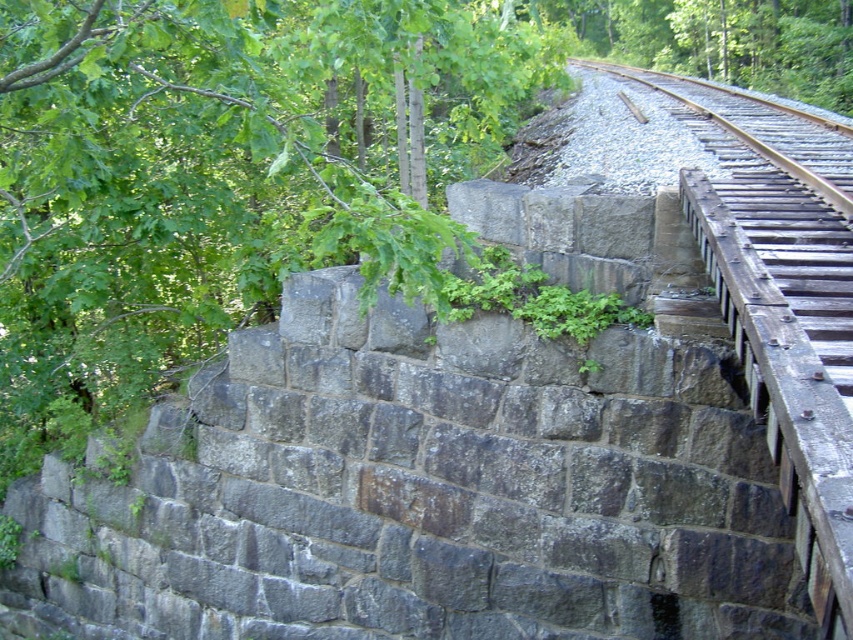
Question: Can you confirm if green leafy tree at upper left is positioned to the right of smooth brown wood at upper right?

Choices:
 (A) no
 (B) yes

Answer: (A)

Question: Is green leafy tree at upper left smaller than smooth brown wood at upper right?

Choices:
 (A) no
 (B) yes

Answer: (A)

Question: Does green leafy tree at upper left have a smaller size compared to smooth brown wood at upper right?

Choices:
 (A) yes
 (B) no

Answer: (B)

Question: Which of the following is the farthest from the observer?

Choices:
 (A) green leafy tree at upper left
 (B) smooth brown wood at upper right

Answer: (B)

Question: Which point is farther to the camera?

Choices:
 (A) green leafy tree at upper left
 (B) smooth brown wood at upper right

Answer: (B)